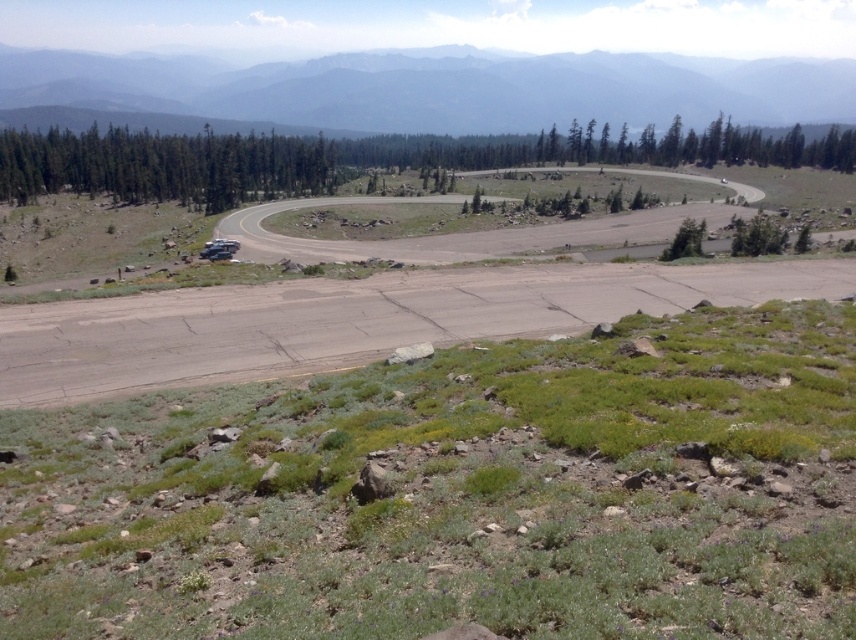
Question: Is dirt road at center below gray foggy mountain at upper center?

Choices:
 (A) yes
 (B) no

Answer: (A)

Question: Which object appears closest to the camera in this image?

Choices:
 (A) gray foggy mountain at upper center
 (B) dirt road at center

Answer: (B)

Question: Is dirt road at center wider than gray foggy mountain at upper center?

Choices:
 (A) yes
 (B) no

Answer: (B)

Question: Considering the relative positions of dirt road at center and gray foggy mountain at upper center in the image provided, where is dirt road at center located with respect to gray foggy mountain at upper center?

Choices:
 (A) right
 (B) left

Answer: (A)

Question: Which point appears closest to the camera in this image?

Choices:
 (A) (797, 268)
 (B) (813, 97)

Answer: (A)